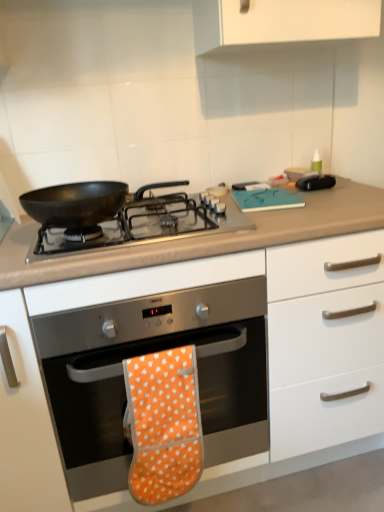
Question: Should I look upward or downward to see white matte cabinet at center?

Choices:
 (A) down
 (B) up

Answer: (A)

Question: Does orange fabric oven mitt at center come in front of white matte cabinet at center?

Choices:
 (A) yes
 (B) no

Answer: (B)

Question: Is orange fabric oven mitt at center bigger than white matte cabinet at center?

Choices:
 (A) no
 (B) yes

Answer: (A)

Question: From a real-world perspective, does orange fabric oven mitt at center sit lower than white matte cabinet at center?

Choices:
 (A) no
 (B) yes

Answer: (B)

Question: Is orange fabric oven mitt at center positioned with its back to white matte cabinet at center?

Choices:
 (A) no
 (B) yes

Answer: (B)

Question: Is orange fabric oven mitt at center surrounding white matte cabinet at center?

Choices:
 (A) no
 (B) yes

Answer: (A)

Question: Is orange fabric oven mitt at center facing towards white matte cabinet at center?

Choices:
 (A) no
 (B) yes

Answer: (B)

Question: Is orange fabric oven mitt at center positioned with its back to white matte cabinet at center?

Choices:
 (A) no
 (B) yes

Answer: (B)

Question: Is orange fabric oven mitt at center facing towards white matte cabinet at center?

Choices:
 (A) yes
 (B) no

Answer: (A)

Question: Does orange fabric oven mitt at center appear on the left side of white matte cabinet at center?

Choices:
 (A) no
 (B) yes

Answer: (B)

Question: From a real-world perspective, does orange fabric oven mitt at center sit lower than white matte cabinet at center?

Choices:
 (A) no
 (B) yes

Answer: (B)

Question: Is orange fabric oven mitt at center to the right of white matte cabinet at center from the viewer's perspective?

Choices:
 (A) yes
 (B) no

Answer: (B)

Question: Considering the relative sizes of orange fabric oven mitt at center and white matte cabinet at center in the image provided, is orange fabric oven mitt at center thinner than white matte cabinet at center?

Choices:
 (A) no
 (B) yes

Answer: (B)

Question: From the image's perspective, is white matte cabinet at center located above matte black pan at center?

Choices:
 (A) yes
 (B) no

Answer: (B)